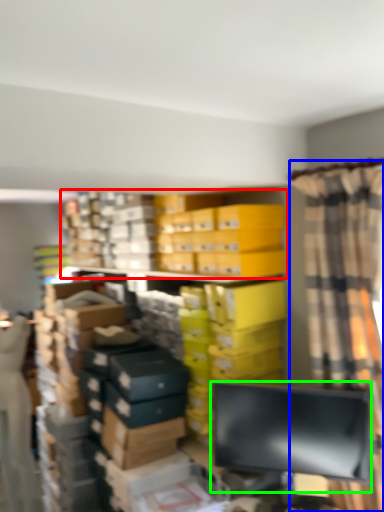
Question: Which object is the farthest from bookcase (highlighted by a red box)? Choose among these: curtain (highlighted by a blue box) or computer monitor (highlighted by a green box).

Choices:
 (A) curtain
 (B) computer monitor

Answer: (B)